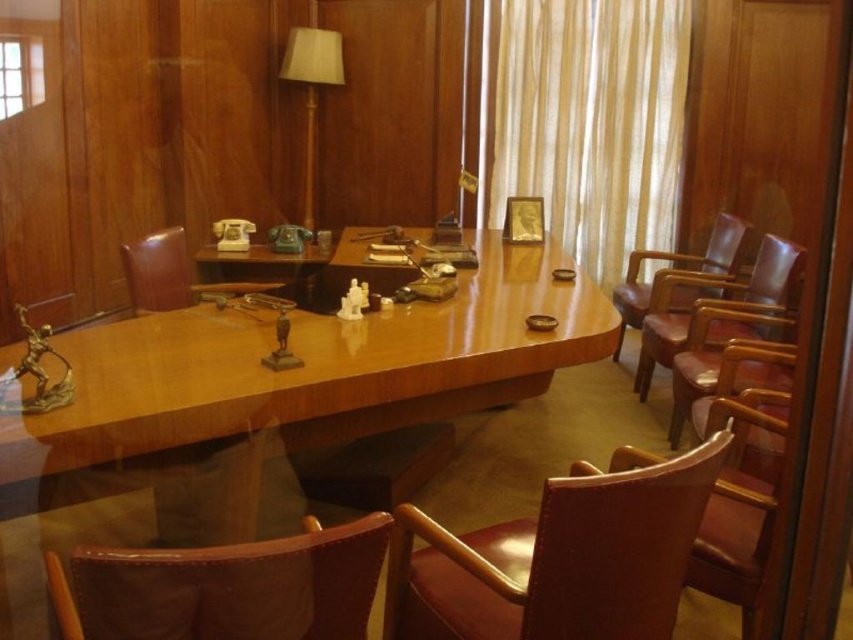
You are standing in the meeting room and need to place a small item exactly at the point marked as point (x=265, y=406). According to the scene description, where should this point be located?

The point (x=265, y=406) is located on the wooden table at center.

You are standing in the meeting room and want to determine which of the two points, point (x=189, y=259) or point (x=711, y=269), is closer to you. Based on the image, which point is nearer?

Point (x=189, y=259) is closer to the camera than point (x=711, y=269), so it is nearer to you.

You are standing in the meeting room and want to know how far you are from the point marked at coordinates point (786, 300). Can you determine the distance?

The distance between you and the point (786, 300) is 10.75 feet.